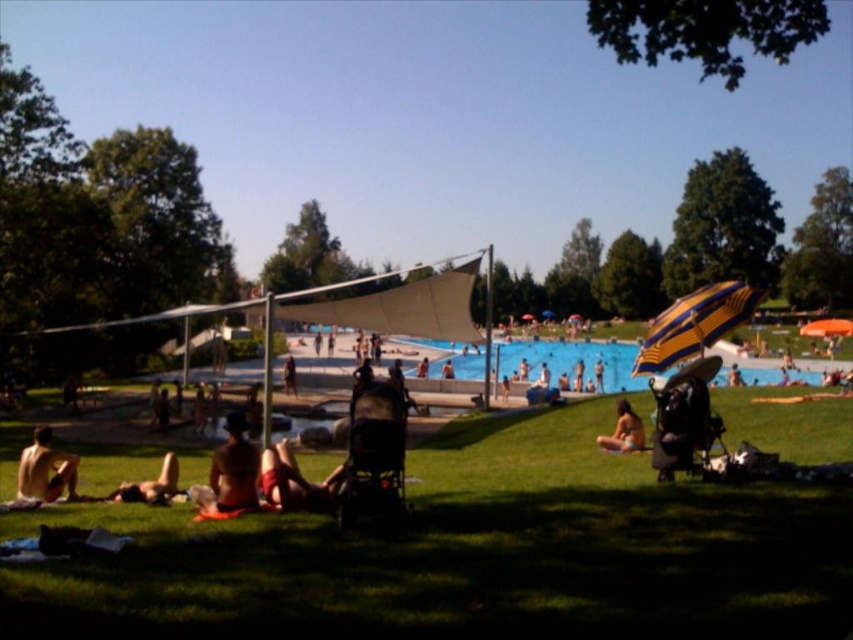
Question: Which of the following is the closest to the observer?

Choices:
 (A) green grass at lower center
 (B) skinny bikini at lower left

Answer: (A)

Question: Is green grass at lower center to the right of smooth skin person at center from the viewer's perspective?

Choices:
 (A) no
 (B) yes

Answer: (B)

Question: Among these objects, which one is nearest to the camera?

Choices:
 (A) skinny white man at lower left
 (B) skinny bikini at lower left
 (C) smooth skin person at center
 (D) green grass at lower center

Answer: (D)

Question: Is smooth skin person at center bigger than skinny white man at lower left?

Choices:
 (A) no
 (B) yes

Answer: (A)

Question: Does smooth skin person at center appear on the left side of tan skin person at center?

Choices:
 (A) yes
 (B) no

Answer: (B)

Question: Which point appears closest to the camera in this image?

Choices:
 (A) (18, 488)
 (B) (752, 285)

Answer: (A)